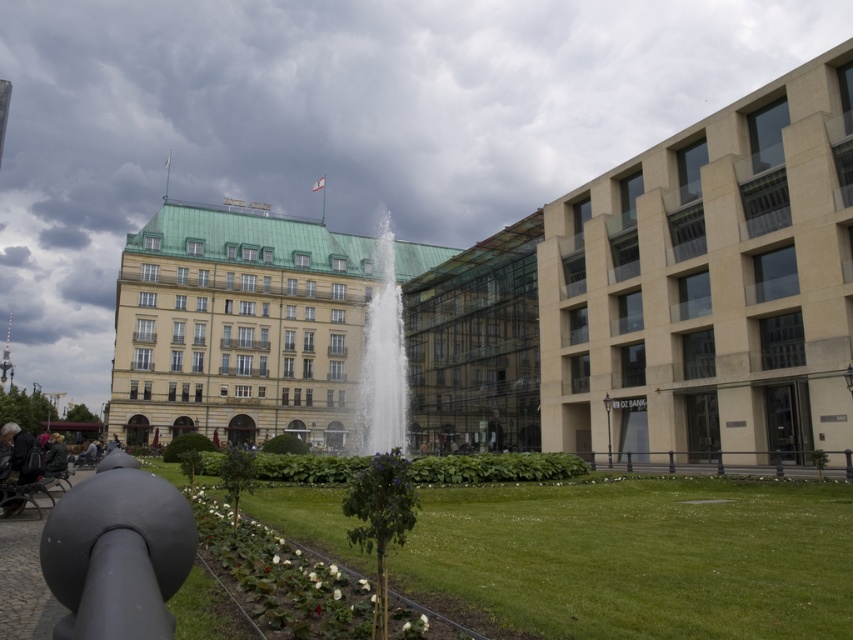
Does cloudy sky at upper center have a lesser width compared to matte black cannon at lower left?

No.

Is cloudy sky at upper center closer to camera compared to matte black cannon at lower left?

No, it is not.

The width and height of the screenshot is (853, 640). Find the location of `cloudy sky at upper center`. cloudy sky at upper center is located at coordinates (334, 124).

This screenshot has width=853, height=640. I want to click on cloudy sky at upper center, so click(x=334, y=124).

Can you confirm if clear water fountain at center is shorter than dark gray fabric jacket at lower left?

No, clear water fountain at center is not shorter than dark gray fabric jacket at lower left.

Does clear water fountain at center have a larger size compared to dark gray fabric jacket at lower left?

Yes, clear water fountain at center is bigger than dark gray fabric jacket at lower left.

What do you see at coordinates (381, 358) in the screenshot? The width and height of the screenshot is (853, 640). I see `clear water fountain at center` at bounding box center [381, 358].

The height and width of the screenshot is (640, 853). What are the coordinates of `clear water fountain at center` in the screenshot? It's located at (381, 358).

Is dark gray leather jacket at lower left thinner than dark gray fabric jacket at lower left?

Incorrect, dark gray leather jacket at lower left's width is not less than dark gray fabric jacket at lower left's.

Does point (21, 442) come behind point (62, 458)?

No, (21, 442) is in front of (62, 458).

Locate an element on the screen. dark gray leather jacket at lower left is located at coordinates (20, 451).